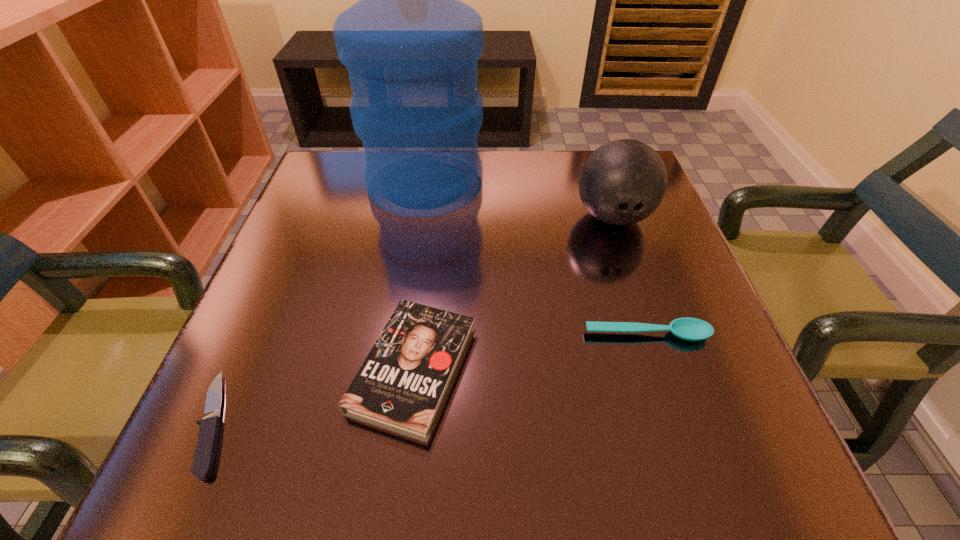
Locate an element on the screen. The height and width of the screenshot is (540, 960). water jug is located at coordinates (411, 47).

Identify the location of bowling ball. This screenshot has width=960, height=540. (622, 182).

At what (x,y) coordinates should I click in order to perform the action: click on the third tallest object. Please return your answer as a coordinate pair (x, y). Looking at the image, I should click on (402, 385).

Where is `spoon`? spoon is located at coordinates (692, 329).

The width and height of the screenshot is (960, 540). Identify the location of the shortest object. (207, 443).

Find the location of `the leftmost object`. the leftmost object is located at coordinates (207, 443).

The width and height of the screenshot is (960, 540). In order to click on free space located on the right of the water jug in this screenshot , I will do `click(646, 184)`.

The image size is (960, 540). I want to click on vacant space situated on the grip area of the fourth shortest object, so coord(629,264).

Where is `vacant space located 0.340m on the back of the book`? vacant space located 0.340m on the back of the book is located at coordinates (435, 197).

Locate an element on the screen. This screenshot has width=960, height=540. vacant space located 0.160m on the back of the spoon is located at coordinates (623, 260).